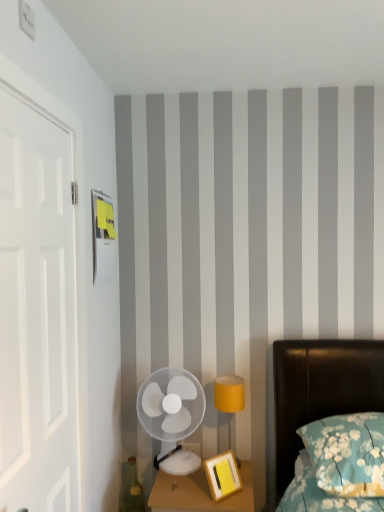
The image size is (384, 512). I want to click on empty space that is ontop of wooden nightstand at lower center (from a real-world perspective), so click(x=198, y=481).